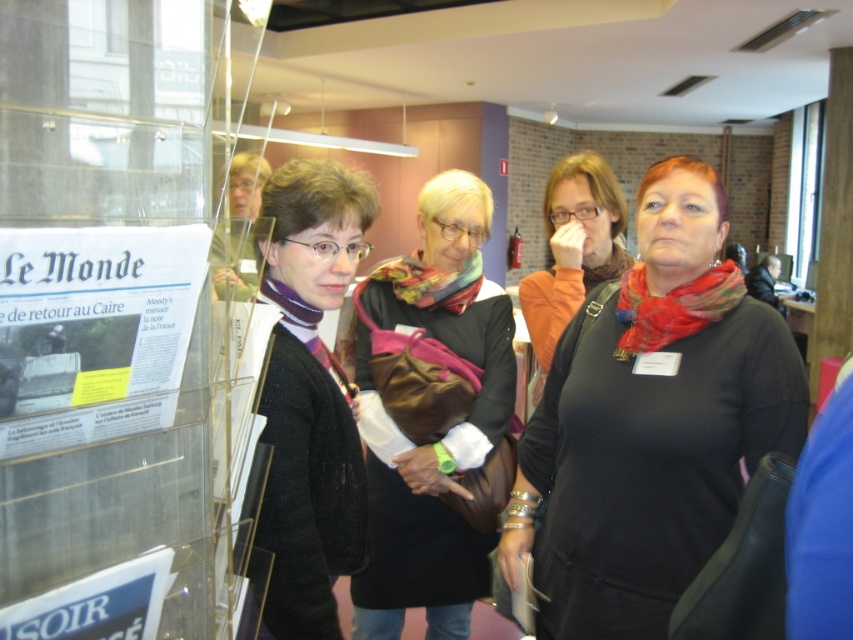
You are a photographer trying to capture a clear shot of the matte black shirt at center and the multicolored knitted scarf at center. Which object is closer to the camera?

The matte black shirt at center is closer to the camera because it is in front of the multicolored knitted scarf at center.

Looking at the group of women in the foreground, which clothing item is positioned lower on the person wearing both the matte black shirt at center and the multicolored knitted scarf at center?

Answer: The matte black shirt at center is located below the multicolored knitted scarf at center, so the matte black shirt at center is positioned lower.